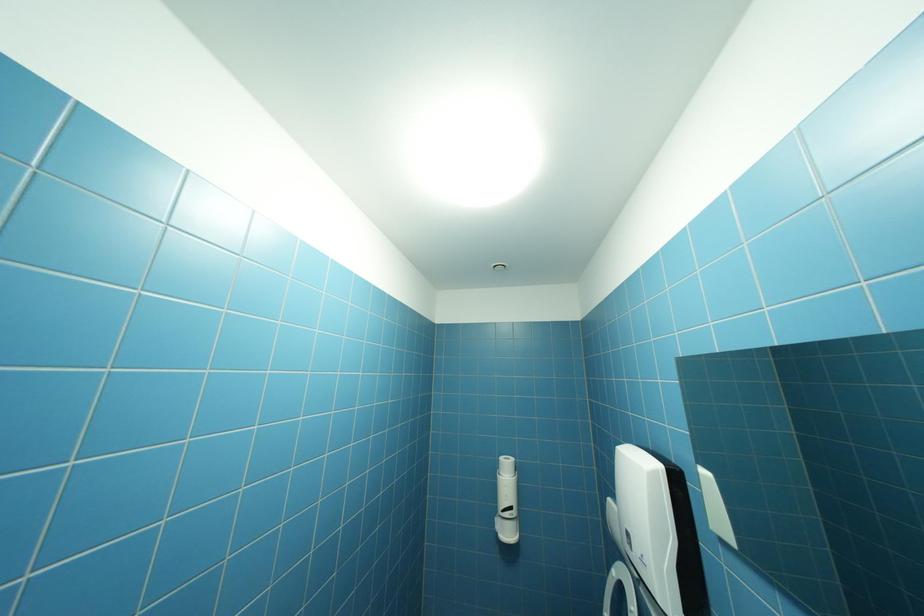
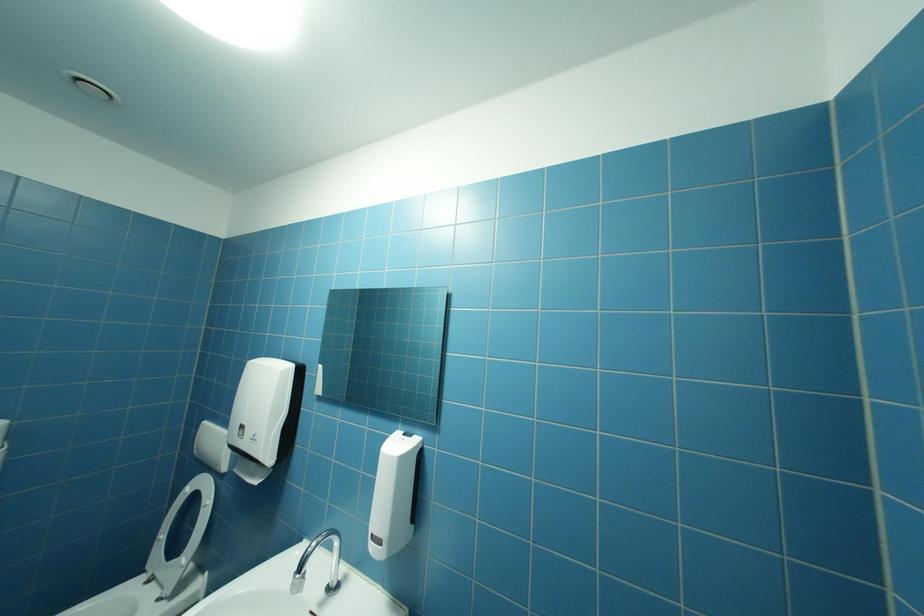
Question: The first image is from the beginning of the video and the second image is from the end. How did the camera likely rotate when shooting the video?

Choices:
 (A) Left
 (B) Right
 (C) Up
 (D) Down

Answer: (B)